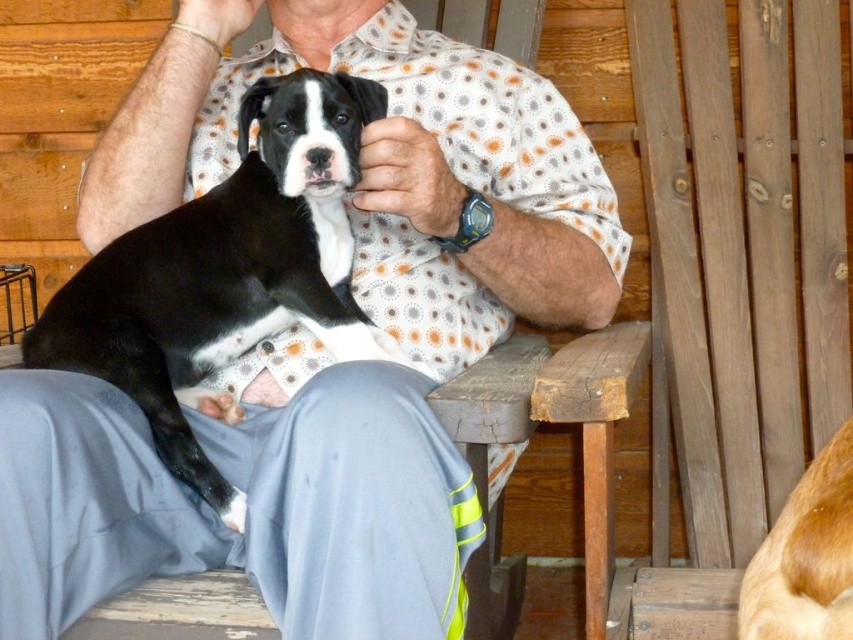
Question: Is wooden slats chair at right smaller than golden fur dog at lower right?

Choices:
 (A) yes
 (B) no

Answer: (B)

Question: Does wooden slats chair at right have a greater width compared to black smooth fur at center?

Choices:
 (A) no
 (B) yes

Answer: (A)

Question: Which point is farther from the camera taking this photo?

Choices:
 (A) (727, 596)
 (B) (792, 529)
 (C) (170, 524)
 (D) (164, 321)

Answer: (A)

Question: Observing the image, what is the correct spatial positioning of wooden slats chair at right in reference to golden fur dog at lower right?

Choices:
 (A) below
 (B) above

Answer: (B)

Question: Among these points, which one is nearest to the camera?

Choices:
 (A) (804, 525)
 (B) (717, 51)
 (C) (618, 216)

Answer: (A)

Question: Which point is closer to the camera?

Choices:
 (A) golden fur dog at lower right
 (B) wooden slats chair at right

Answer: (A)